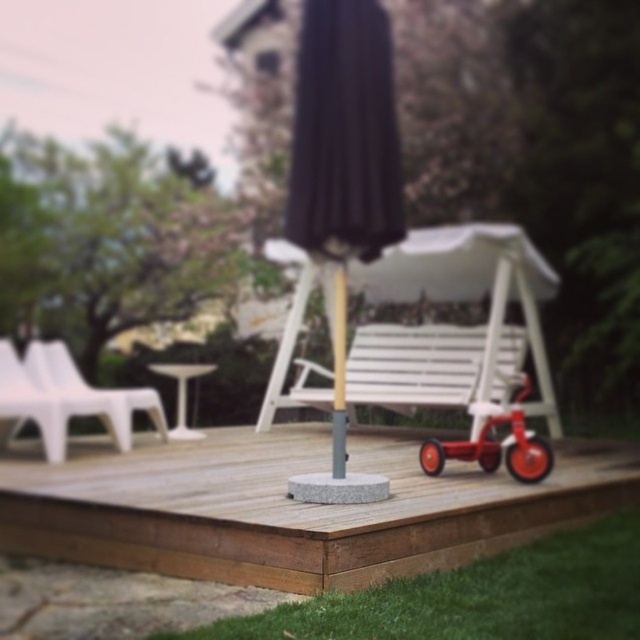
Based on the photo, which is more to the left, black fabric umbrella at center or white plastic stool at lower center?

Positioned to the left is white plastic stool at lower center.

Can you confirm if black fabric umbrella at center is shorter than white plastic stool at lower center?

No.

Measure the distance between point (x=374, y=131) and camera.

Point (x=374, y=131) and camera are 11.61 feet apart from each other.

The width and height of the screenshot is (640, 640). Find the location of `black fabric umbrella at center`. black fabric umbrella at center is located at coordinates pos(344,154).

Can you confirm if black fabric umbrella at center is smaller than white plastic chair at left?

Yes.

From the picture: Does black fabric umbrella at center appear over white plastic chair at left?

Yes, black fabric umbrella at center is above white plastic chair at left.

What do you see at coordinates (344, 154) in the screenshot?
I see `black fabric umbrella at center` at bounding box center [344, 154].

I want to click on black fabric umbrella at center, so click(344, 154).

Who is shorter, wooden pole at center or white plastic stool at lower center?

white plastic stool at lower center

Image resolution: width=640 pixels, height=640 pixels. Identify the location of wooden pole at center. (339, 376).